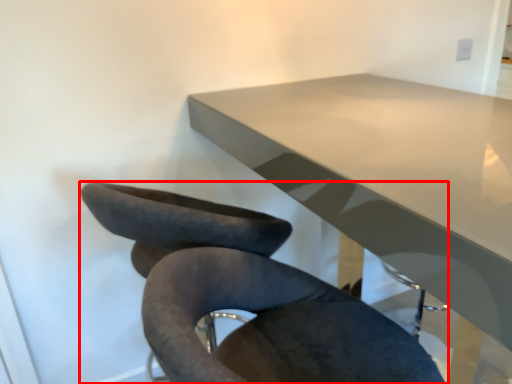
Question: Considering the relative positions of chair (annotated by the red box) and table in the image provided, where is chair (annotated by the red box) located with respect to the staircase?

Choices:
 (A) right
 (B) left

Answer: (B)